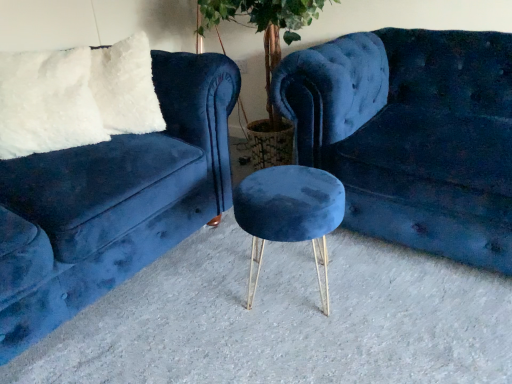
Image resolution: width=512 pixels, height=384 pixels. Identify the location of vacant space in between velvet blue couch at left, the first studio couch when ordered from left to right, and velvet blue stool at center. (195, 311).